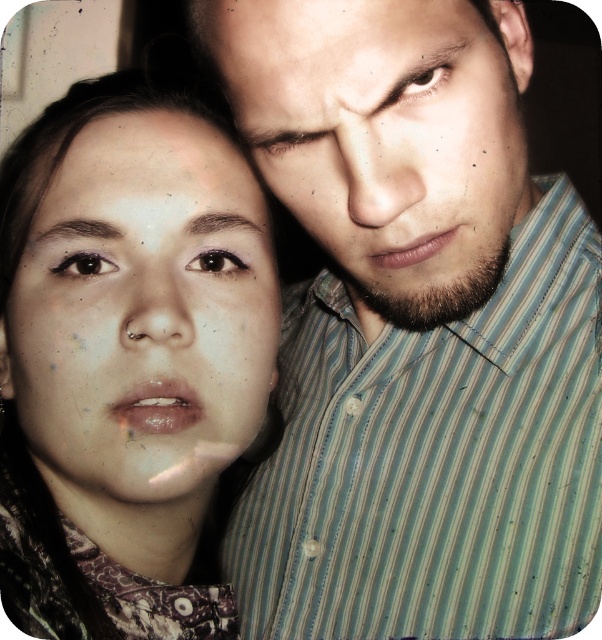
Question: Can you confirm if striped shirt at upper right is positioned to the left of matte striped shirt at upper right?

Choices:
 (A) yes
 (B) no

Answer: (B)

Question: Does striped shirt at upper right come in front of matte skin face at left?

Choices:
 (A) yes
 (B) no

Answer: (A)

Question: Among these objects, which one is farthest from the camera?

Choices:
 (A) matte skin face at left
 (B) striped shirt at upper right

Answer: (A)

Question: Which object is closer to the camera taking this photo?

Choices:
 (A) matte skin face at left
 (B) matte striped shirt at upper right
 (C) striped shirt at upper right

Answer: (B)

Question: Considering the real-world distances, which object is closest to the striped shirt at upper right?

Choices:
 (A) matte skin face at left
 (B) matte striped shirt at upper right

Answer: (B)

Question: Is striped shirt at upper right wider than matte skin face at left?

Choices:
 (A) no
 (B) yes

Answer: (B)